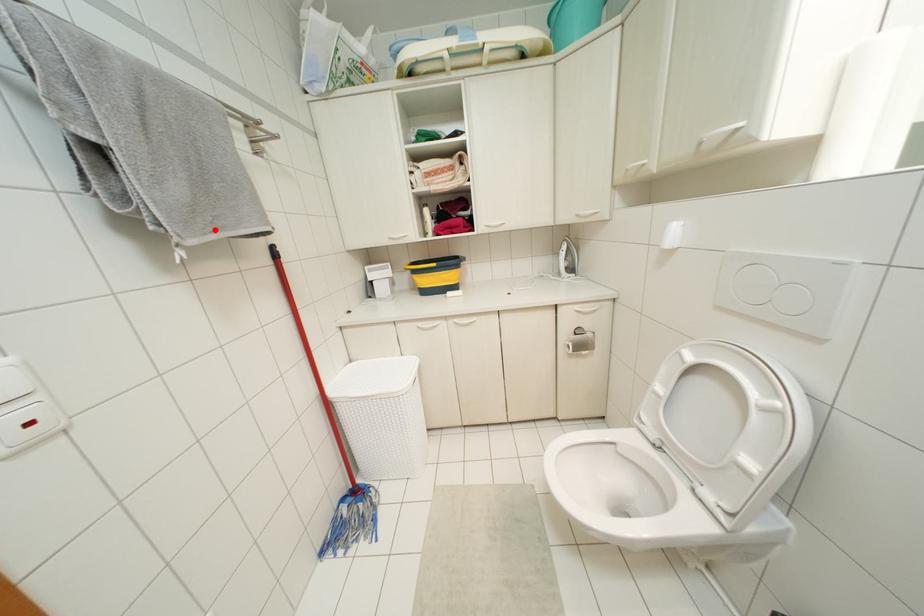
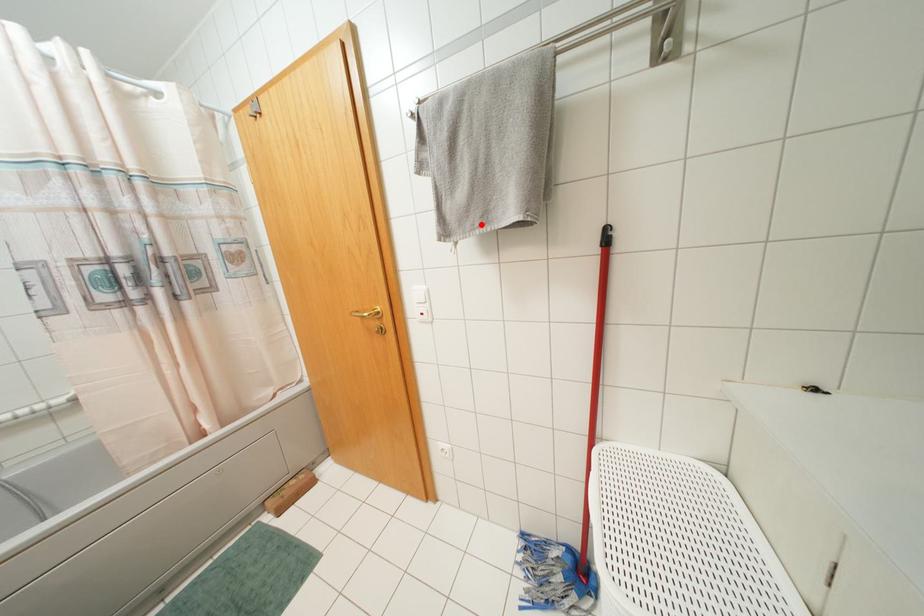
I am providing you with two images of the same scene from different viewpoints. A red point is marked on the first image and another point is marked on the second image. Does the point marked in image1 correspond to the same location as the one in image2?

Yes